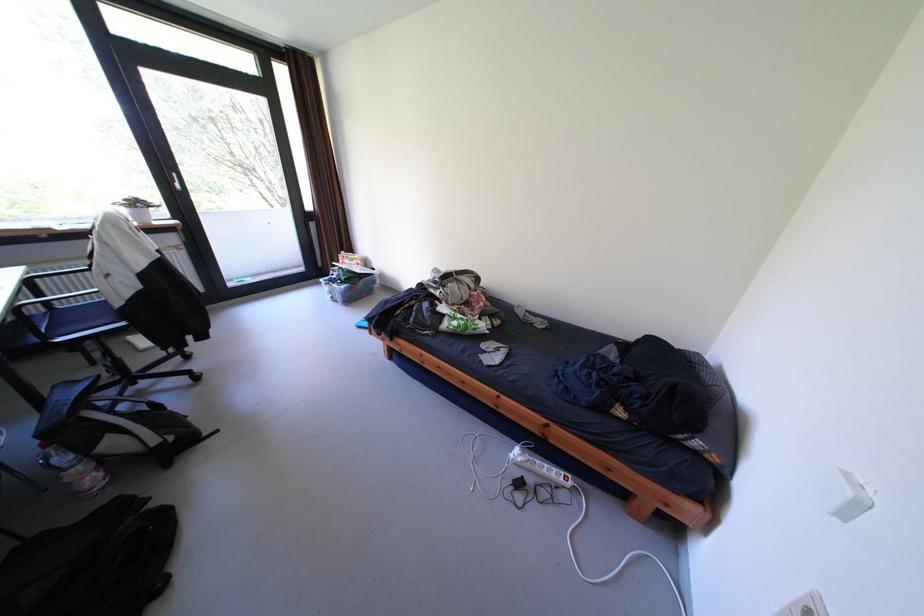
Image resolution: width=924 pixels, height=616 pixels. What are the coordinates of `white potted plant` in the screenshot? It's located at (137, 208).